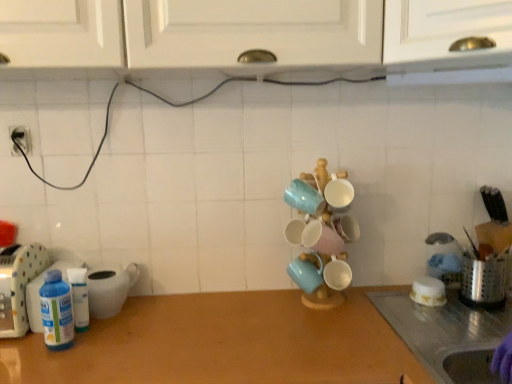
What are the coordinates of `empty space that is ontop of wooden at center (from a real-world perspective)` in the screenshot? It's located at (256, 334).